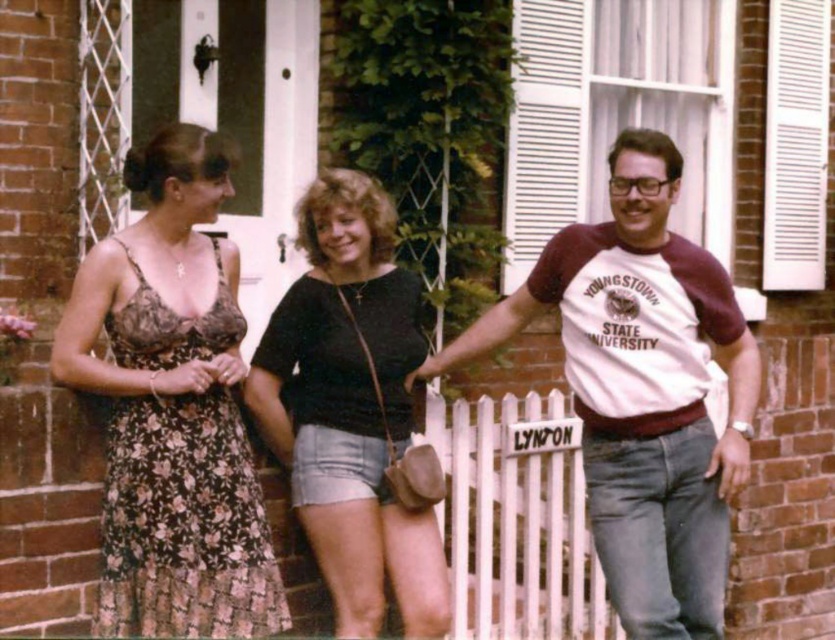
Question: Is floral dress at left positioned behind white cotton t-shirt at center?

Choices:
 (A) no
 (B) yes

Answer: (A)

Question: Among these objects, which one is farthest from the camera?

Choices:
 (A) floral dress at left
 (B) floral-patterned dress at left

Answer: (A)

Question: Which object is the farthest from the white cotton t-shirt at center?

Choices:
 (A) black cotton shirt at center
 (B) floral-patterned dress at left
 (C) floral dress at left

Answer: (B)

Question: Is floral-patterned dress at left above black cotton shirt at center?

Choices:
 (A) no
 (B) yes

Answer: (B)

Question: Which of the following is the farthest from the observer?

Choices:
 (A) white cotton t-shirt at center
 (B) floral dress at left

Answer: (A)

Question: From the image, what is the correct spatial relationship of floral dress at left in relation to white cotton t-shirt at center?

Choices:
 (A) above
 (B) below

Answer: (A)